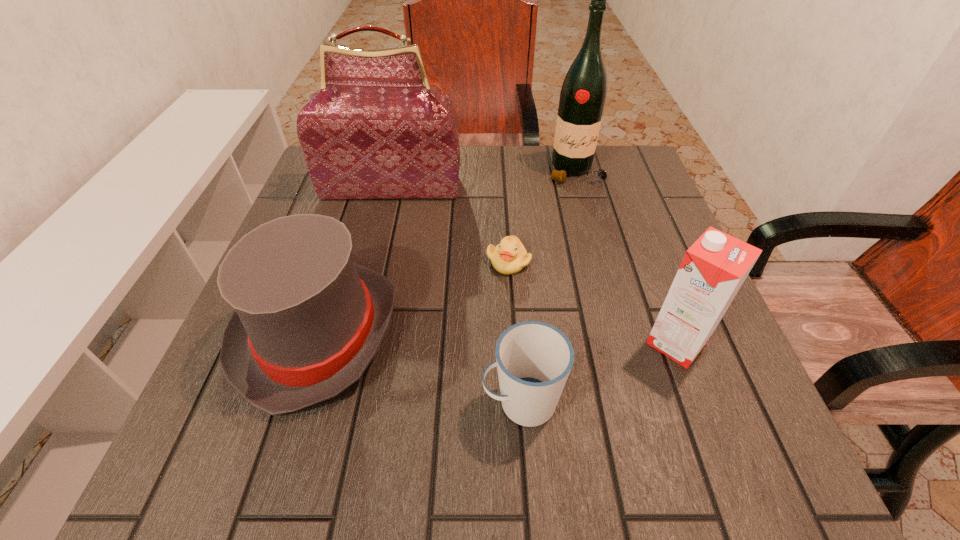
The image size is (960, 540). In order to click on wine bottle in this screenshot , I will do `click(582, 98)`.

At what (x,y) coordinates should I click in order to perform the action: click on handbag. Please return your answer as a coordinate pair (x, y). The image size is (960, 540). Looking at the image, I should click on (376, 130).

Locate an element on the screen. The image size is (960, 540). carton is located at coordinates (713, 269).

What are the coordinates of `dress hat` in the screenshot? It's located at tap(307, 322).

Where is `cup`? cup is located at coordinates (534, 359).

This screenshot has height=540, width=960. I want to click on duckling, so click(x=509, y=257).

At what (x,y) coordinates should I click in order to perform the action: click on vacant space situated on the surface of the wine bottle. Please return your answer as a coordinate pair (x, y). Image resolution: width=960 pixels, height=540 pixels. Looking at the image, I should click on (612, 309).

Where is `free space located 0.210m on the front-facing side of the handbag`? free space located 0.210m on the front-facing side of the handbag is located at coordinates pyautogui.click(x=373, y=262).

Locate an element on the screen. free space located 0.100m on the left of the carton is located at coordinates (588, 342).

The width and height of the screenshot is (960, 540). I want to click on vacant area situated 0.110m on the back of the fourth tallest object, so click(349, 234).